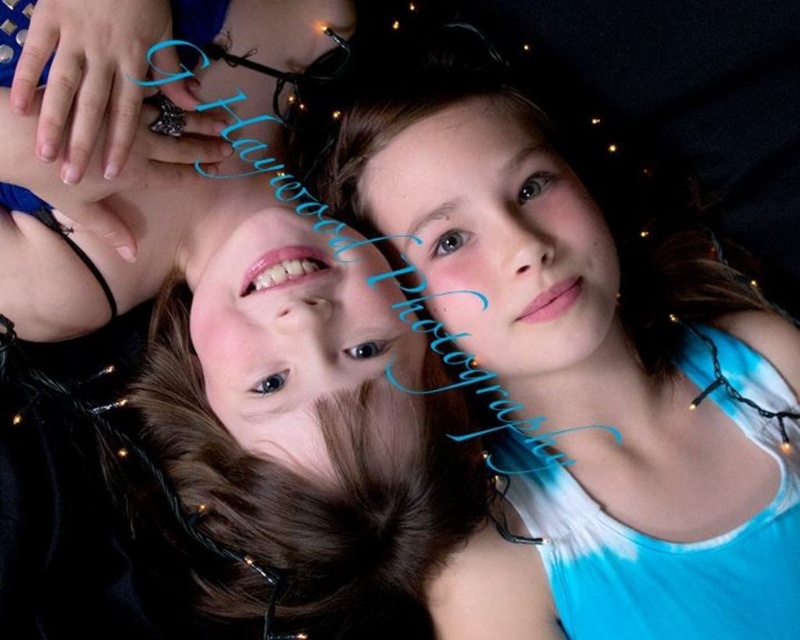
Question: Does blue tie-dye tank top at upper center have a smaller size compared to blue tie-dye tank top at upper right?

Choices:
 (A) no
 (B) yes

Answer: (A)

Question: Which point appears closest to the camera in this image?

Choices:
 (A) (374, 486)
 (B) (494, 218)

Answer: (A)

Question: Where is blue tie-dye tank top at upper center located in relation to blue tie-dye tank top at upper right in the image?

Choices:
 (A) below
 (B) above

Answer: (A)

Question: Which point is farther from the camera taking this photo?

Choices:
 (A) (218, 275)
 (B) (608, 573)

Answer: (A)

Question: Can you confirm if blue tie-dye tank top at upper center is positioned to the left of blue tie-dye tank top at upper right?

Choices:
 (A) no
 (B) yes

Answer: (B)

Question: Which of the following is the closest to the observer?

Choices:
 (A) blue tie-dye tank top at upper right
 (B) blue tie-dye tank top at upper center

Answer: (B)